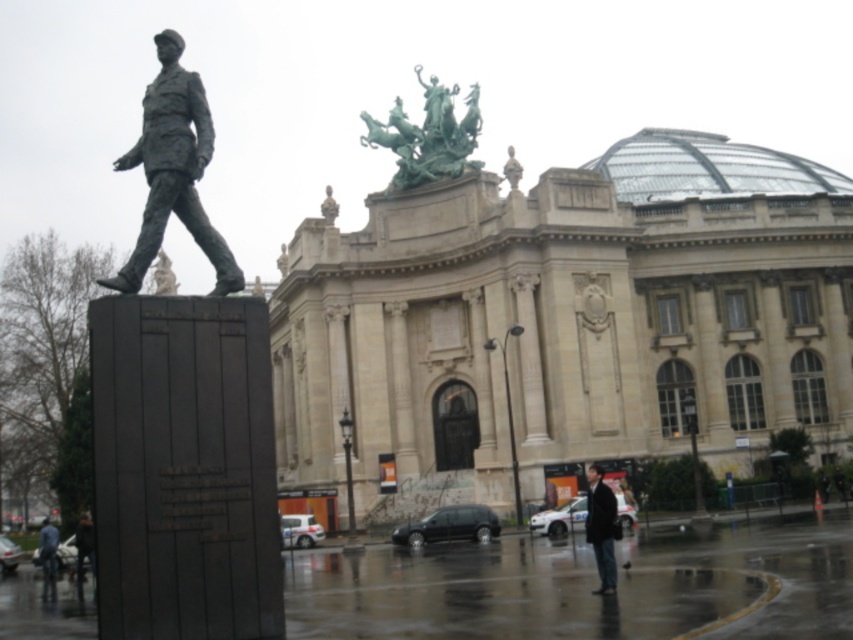
Question: Which point is farther from the camera taking this photo?

Choices:
 (A) (372, 138)
 (B) (132, 273)

Answer: (A)

Question: Is bronze statue at left below denim jacket at lower left?

Choices:
 (A) no
 (B) yes

Answer: (A)

Question: Estimate the real-world distances between objects in this image. Which object is closer to the dark brown leather jacket at lower center?

Choices:
 (A) green polished bronze statue at upper center
 (B) bronze statue at left

Answer: (B)

Question: Can you confirm if green polished bronze statue at upper center is thinner than denim jacket at lower left?

Choices:
 (A) yes
 (B) no

Answer: (A)

Question: Which object is farther from the camera taking this photo?

Choices:
 (A) dark brown leather jacket at lower center
 (B) denim jacket at lower left
 (C) bronze statue at left
 (D) green polished bronze statue at upper center

Answer: (D)

Question: Does bronze statue at left have a greater width compared to denim jacket at lower left?

Choices:
 (A) yes
 (B) no

Answer: (A)